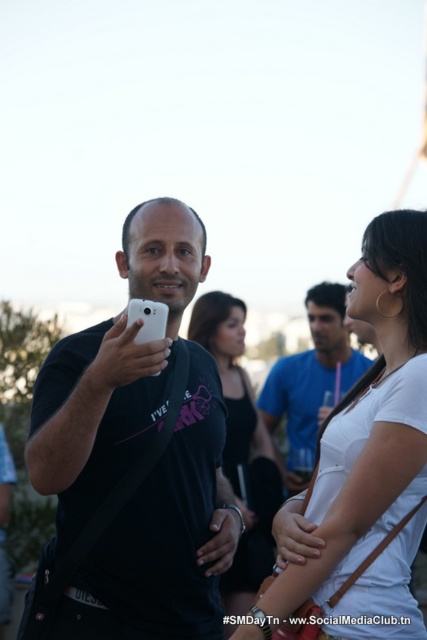
Between white matte phone at center and white cotton shirt at center, which one appears on the left side from the viewer's perspective?

white matte phone at center

Does white matte phone at center have a greater width compared to white cotton shirt at center?

Correct, the width of white matte phone at center exceeds that of white cotton shirt at center.

The image size is (427, 640). Identify the location of white matte phone at center. (136, 456).

Between matte black shirt at center and matte black t-shirt at center, which one is positioned higher?

matte black t-shirt at center is above.

Which is more to the right, matte black shirt at center or matte black t-shirt at center?

matte black t-shirt at center is more to the right.

Measure the distance between point (248, 465) and camera.

The distance of point (248, 465) from camera is 27.88 meters.

This screenshot has width=427, height=640. I want to click on matte black shirt at center, so click(240, 448).

Can you confirm if white cotton shirt at center is positioned above matte black shirt at center?

Yes, white cotton shirt at center is above matte black shirt at center.

The width and height of the screenshot is (427, 640). Describe the element at coordinates (366, 465) in the screenshot. I see `white cotton shirt at center` at that location.

Is point (409, 269) positioned behind point (249, 385)?

No, (409, 269) is in front of (249, 385).

Find the location of a particular element. This screenshot has height=640, width=427. white cotton shirt at center is located at coordinates (366, 465).